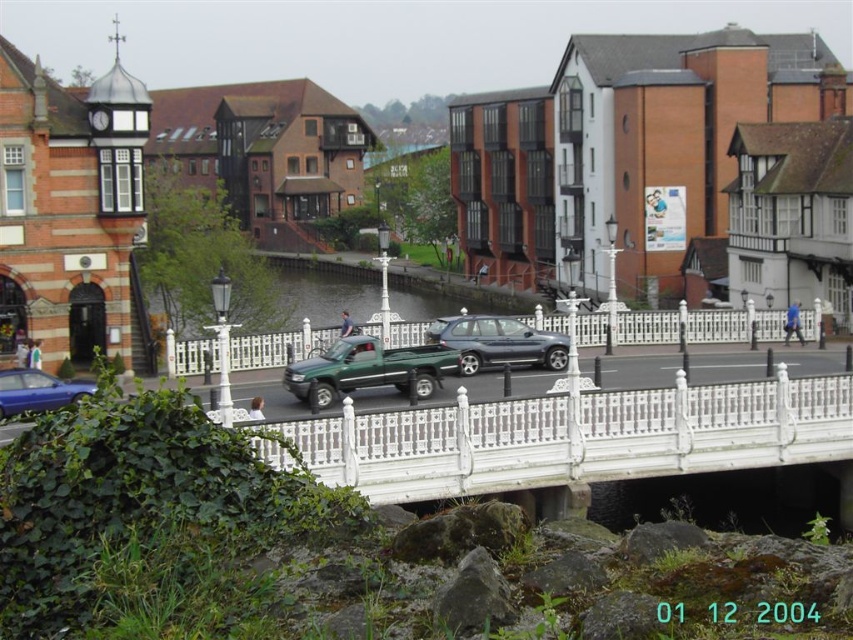
Question: Among these points, which one is nearest to the camera?

Choices:
 (A) (807, 321)
 (B) (434, 323)

Answer: (B)

Question: Which point is closer to the camera taking this photo?

Choices:
 (A) pos(404,468)
 (B) pos(538,355)

Answer: (A)

Question: Is green matte truck at center to the left of metallic blue sedan at lower left from the viewer's perspective?

Choices:
 (A) yes
 (B) no

Answer: (B)

Question: Considering the real-world distances, which object is farthest from the satin silver metallic car at center?

Choices:
 (A) white wrought iron fence at center
 (B) green matte truck at center
 (C) metallic blue sedan at lower left
 (D) white wrought iron bridge at center

Answer: (C)

Question: Does white wrought iron fence at center appear over metallic blue sedan at lower left?

Choices:
 (A) yes
 (B) no

Answer: (A)

Question: Can you confirm if white wrought iron bridge at center is positioned to the left of white wrought iron fence at center?

Choices:
 (A) no
 (B) yes

Answer: (A)